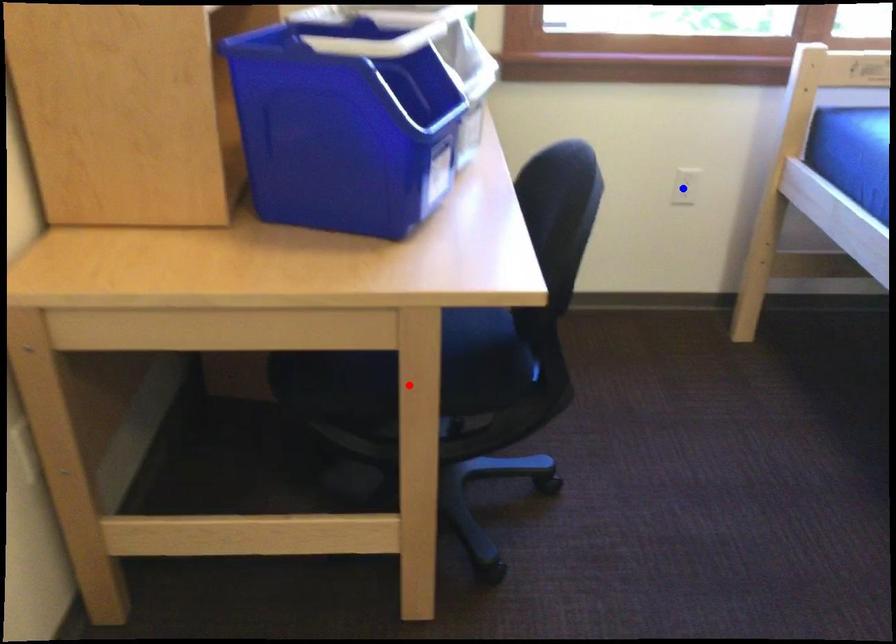
Question: Two points are marked on the image. Which point is closer to the camera?

Choices:
 (A) Blue point is closer.
 (B) Red point is closer.

Answer: (B)